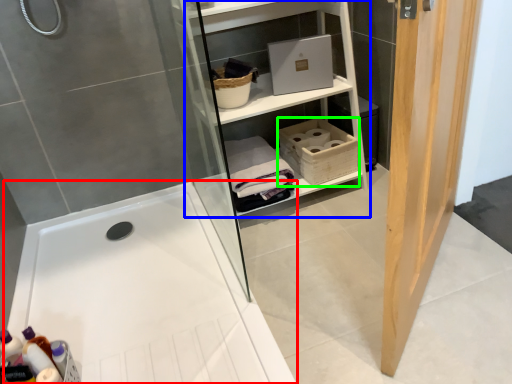
Question: Which is farther away from bathtub (highlighted by a red box)? shelf (highlighted by a blue box) or basket (highlighted by a green box)?

Choices:
 (A) shelf
 (B) basket

Answer: (A)